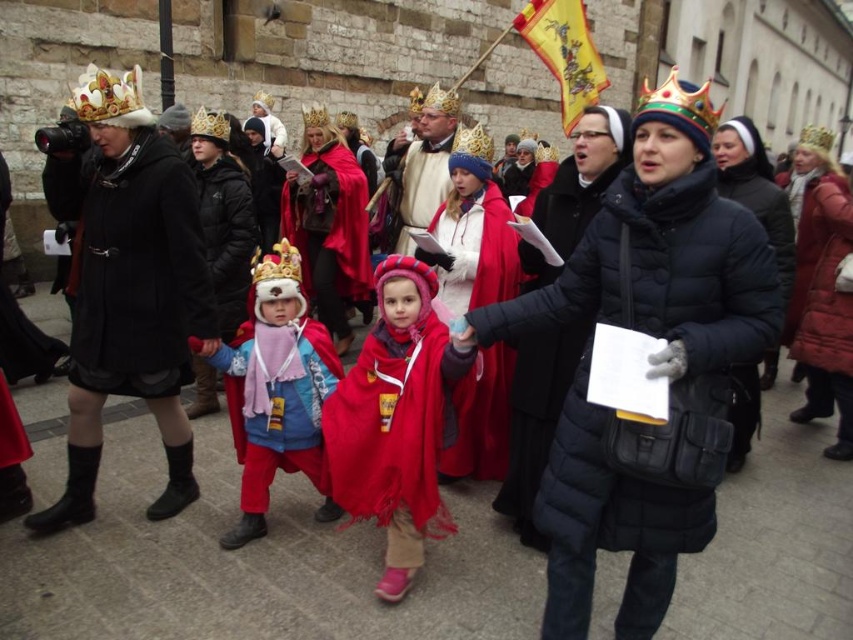
You are a photographer trying to capture a clear shot of the fuzzy red scarf at center and the velvet red cape at center. Which one is blocking the other from your view?

The fuzzy red scarf at center is in front of the velvet red cape at center, so the scarf is blocking the view of the cape.

You are a photographer trying to capture a photo of the black quilted jacket at center and the smooth gold crown at center. Since you want to focus on the jacket, where should you position the crown in relation to the jacket in the frame?

The smooth gold crown at center is above the black quilted jacket at center, so you should position the crown above the jacket in the frame to focus on the jacket.